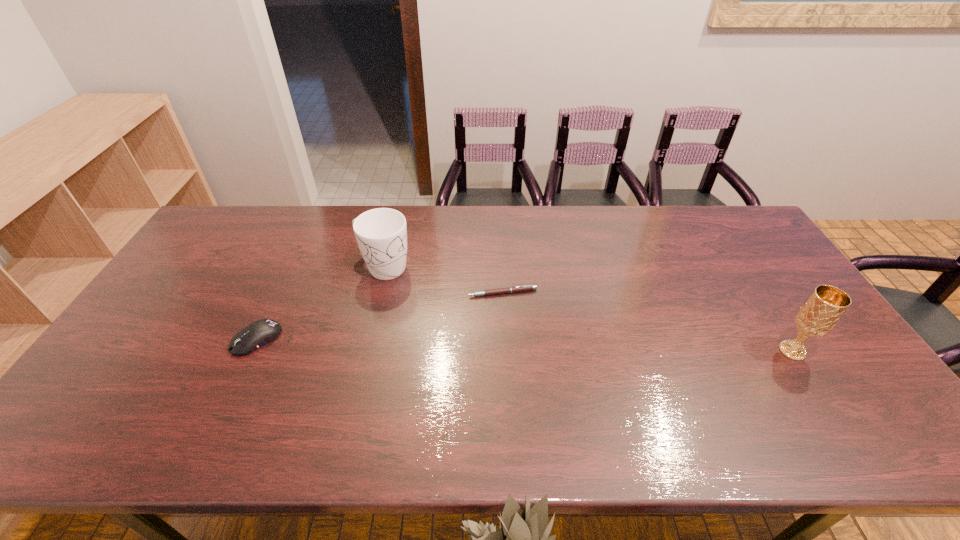
I want to click on the third tallest object, so click(257, 334).

Identify the location of computer equipment. The height and width of the screenshot is (540, 960). (257, 334).

Where is `the rightmost object`? the rightmost object is located at coordinates (820, 313).

The height and width of the screenshot is (540, 960). I want to click on the shortest object, so click(x=514, y=289).

Image resolution: width=960 pixels, height=540 pixels. Find the location of `the second farthest object`. the second farthest object is located at coordinates (514, 289).

Locate an element on the screen. This screenshot has width=960, height=540. the farthest object is located at coordinates (381, 234).

The image size is (960, 540). Find the location of `the second object from left to right`. the second object from left to right is located at coordinates (381, 234).

I want to click on free location located on the right of the leftmost object, so click(298, 340).

This screenshot has height=540, width=960. Find the location of `free point located 0.150m on the back of the rightmost object`. free point located 0.150m on the back of the rightmost object is located at coordinates (759, 299).

Locate an element on the screen. vacant area located 0.160m at the nib of the second farthest object is located at coordinates pos(467,336).